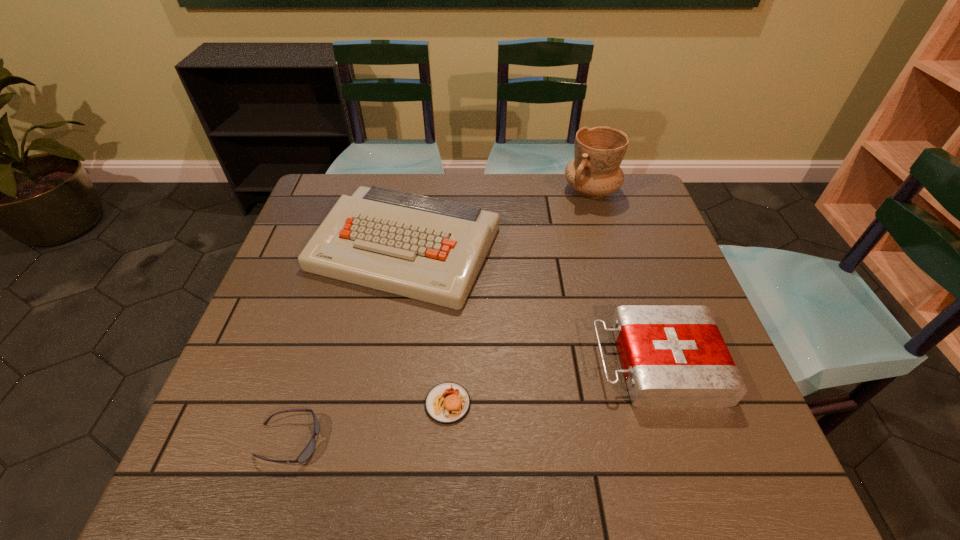
At what (x,y) coordinates should I click in order to perform the action: click on vacant space that's between the first-aid kit and the second shortest object. Please return your answer as a coordinate pair (x, y). This screenshot has width=960, height=540. Looking at the image, I should click on (552, 383).

This screenshot has height=540, width=960. In order to click on unoccupied area between the pottery and the first-aid kit in this screenshot , I will do `click(623, 277)`.

You are a GUI agent. You are given a task and a screenshot of the screen. Output one action in this format:
    pyautogui.click(x=<x>, y=<y>)
    Task: Click on the free area in between the fourth tallest object and the computer keyboard
    
    Given the screenshot: What is the action you would take?
    pyautogui.click(x=426, y=326)

At what (x,y) coordinates should I click in order to perform the action: click on free spot between the patty and the computer keyboard. Please return your answer as a coordinate pair (x, y). The image size is (960, 540). Looking at the image, I should click on (426, 326).

The width and height of the screenshot is (960, 540). Identify the location of empty location between the fourth tallest object and the first-aid kit. (552, 383).

You are a GUI agent. You are given a task and a screenshot of the screen. Output one action in this format:
    pyautogui.click(x=<x>, y=<y>)
    Task: Click on the free space between the first-aid kit and the computer keyboard
    Image resolution: width=960 pixels, height=540 pixels.
    Given the screenshot: What is the action you would take?
    pyautogui.click(x=531, y=306)

Where is `empty space between the tallest object and the sunglasses`? The image size is (960, 540). empty space between the tallest object and the sunglasses is located at coordinates (440, 316).

The width and height of the screenshot is (960, 540). In order to click on object that stands as the third closest to the first-aid kit in this screenshot , I will do `click(595, 171)`.

Identify the location of object that is the second closest to the tallest object. (673, 356).

Find the location of a particular element. Image resolution: width=960 pixels, height=540 pixels. vacant area that satisfies the following two spatial constraints: 1. on the front side of the first-aid kit; 2. on the front side of the fourth tallest object is located at coordinates (669, 403).